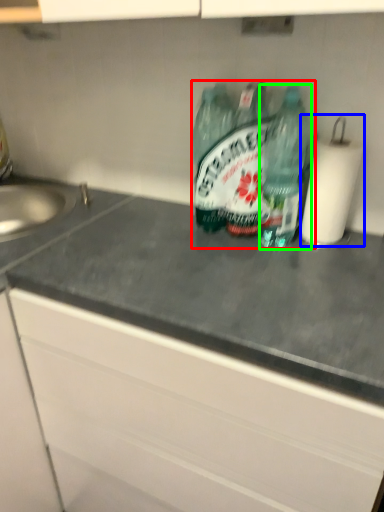
Question: Which is farther away from bottle (highlighted by a red box)? paper towel (highlighted by a blue box) or bottle (highlighted by a green box)?

Choices:
 (A) paper towel
 (B) bottle

Answer: (A)